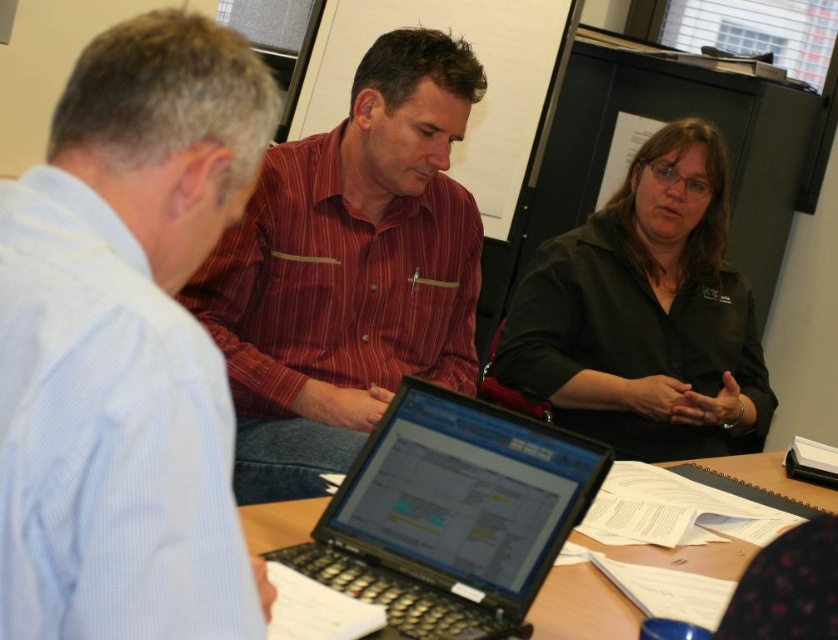
In the scene shown: Can you confirm if blue striped shirt at upper left is bigger than red striped shirt at center?

No.

Looking at this image, does blue striped shirt at upper left have a lesser height compared to red striped shirt at center?

Yes, blue striped shirt at upper left is shorter than red striped shirt at center.

At what (x,y) coordinates should I click in order to perform the action: click on blue striped shirt at upper left. Please return your answer as a coordinate pair (x, y). Looking at the image, I should click on (127, 344).

Find the location of a particular element. blue striped shirt at upper left is located at coordinates (127, 344).

Is black button-down shirt at upper right positioned before wooden table at center?

That is False.

Where is `black button-down shirt at upper right`? This screenshot has height=640, width=838. black button-down shirt at upper right is located at coordinates (645, 314).

Which is above, black button-down shirt at upper right or black plastic laptop at center?

black button-down shirt at upper right is higher up.

Is black button-down shirt at upper right above black plastic laptop at center?

Correct, black button-down shirt at upper right is located above black plastic laptop at center.

Between point (525, 349) and point (366, 476), which one is positioned behind?

Positioned behind is point (525, 349).

Locate an element on the screen. Image resolution: width=838 pixels, height=640 pixels. black button-down shirt at upper right is located at coordinates (645, 314).